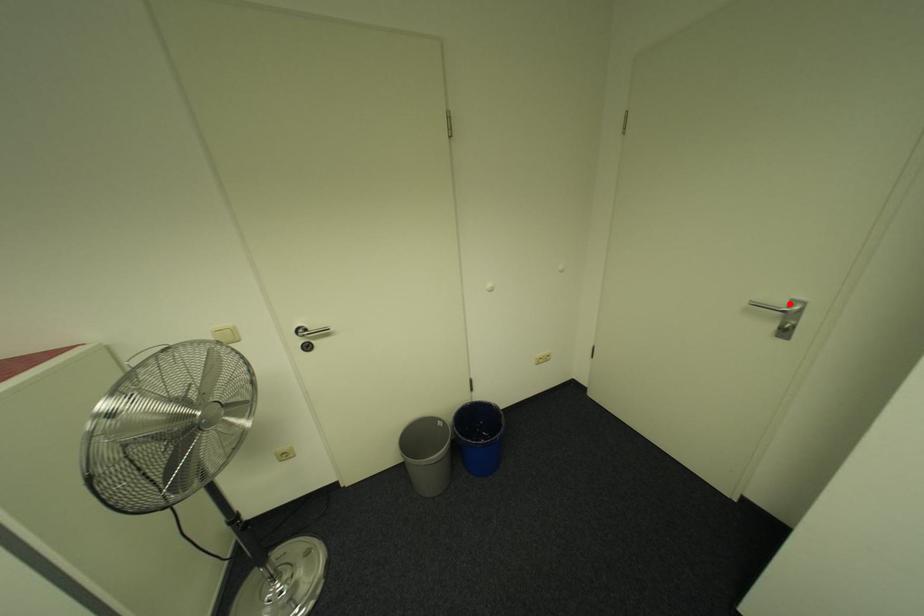
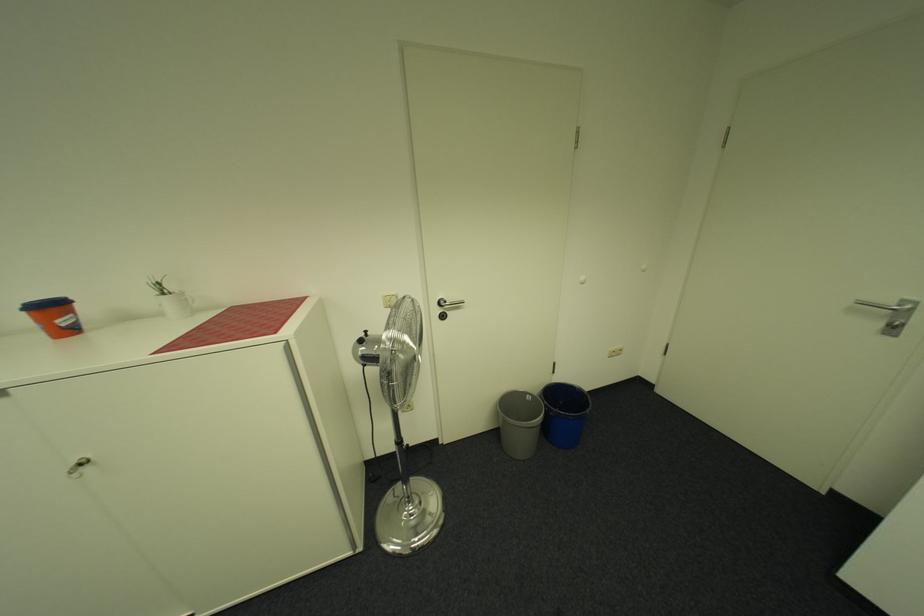
Locate, in the second image, the point that corresponds to the highlighted location in the first image.

(898, 302)